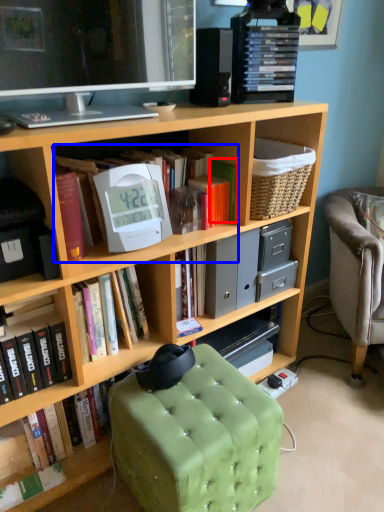
Question: Which of the following is the farthest to the observer, paperback book (highlighted by a red box) or book (highlighted by a blue box)?

Choices:
 (A) paperback book
 (B) book

Answer: (A)